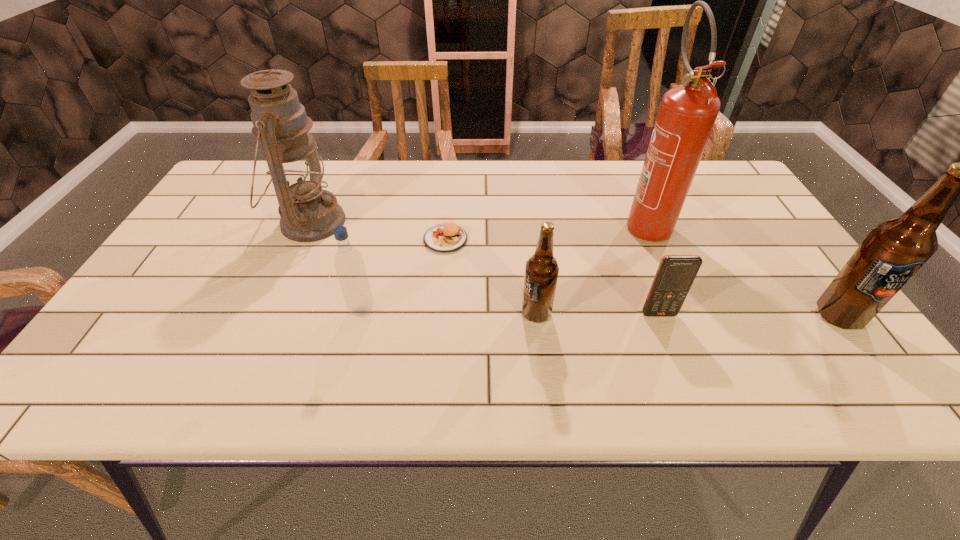
The image size is (960, 540). Find the location of `free space located 0.370m on the label of the left beer bottle`. free space located 0.370m on the label of the left beer bottle is located at coordinates (356, 314).

At what (x,y) coordinates should I click in order to perform the action: click on free space located 0.310m on the label of the left beer bottle. Please return your answer as a coordinate pair (x, y). Looking at the image, I should click on (383, 314).

Identify the location of vacant space positioned 0.360m on the label of the left beer bottle. This screenshot has height=540, width=960. (360, 314).

Identify the location of free space located on the label of the taller beer bottle. The width and height of the screenshot is (960, 540). (869, 356).

This screenshot has height=540, width=960. What are the coordinates of `vacant space located 0.070m from the nozzle of the fire extinguisher` in the screenshot? It's located at (665, 268).

Where is `free location located on the left of the third object from left to right`? This screenshot has height=540, width=960. free location located on the left of the third object from left to right is located at coordinates (322, 239).

Identify the location of free space located 0.210m on the right of the oil lamp. The image size is (960, 540). click(x=421, y=222).

At what (x,y) coordinates should I click in order to perform the action: click on free location located on the screen of the cellular telephone. Please return your answer as a coordinate pair (x, y). This screenshot has width=960, height=540. Looking at the image, I should click on (670, 343).

Identify the location of blank area located on the left of the second object from left to right. The height and width of the screenshot is (540, 960). (251, 311).

Identify the location of fire extinguisher located in the far edge section of the desktop. (687, 114).